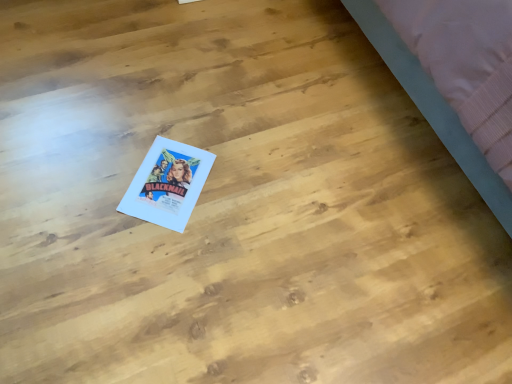
Locate an element on the screen. The image size is (512, 384). vacant space positioned to the left of white paper at center is located at coordinates (99, 160).